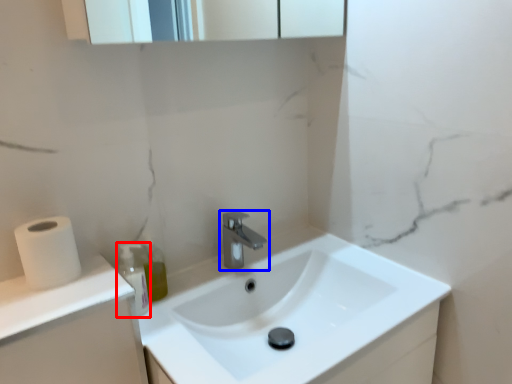
Question: Among these objects, which one is nearest to the camera, bottle (highlighted by a red box) or tap (highlighted by a blue box)?

Choices:
 (A) bottle
 (B) tap

Answer: (A)